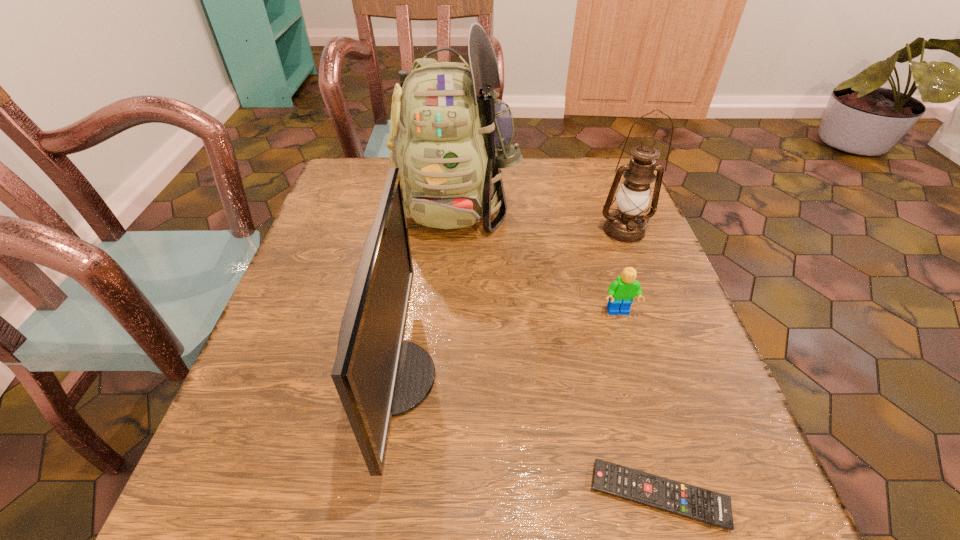
The height and width of the screenshot is (540, 960). I want to click on vacant point located between the Lego and the remote control, so click(638, 404).

This screenshot has height=540, width=960. What are the coordinates of `empty space that is in between the shortest object and the monitor` in the screenshot? It's located at (525, 437).

The width and height of the screenshot is (960, 540). Identify the location of free space between the monitor and the fourth tallest object. (505, 345).

At what (x,y) coordinates should I click in order to perform the action: click on free area in between the oil lamp and the backpack. Please return your answer as a coordinate pair (x, y). Looking at the image, I should click on (540, 215).

The width and height of the screenshot is (960, 540). I want to click on vacant area between the fourth tallest object and the oil lamp, so click(621, 272).

Where is `object that is the third closest one to the tallest object`? The height and width of the screenshot is (540, 960). object that is the third closest one to the tallest object is located at coordinates (621, 292).

Image resolution: width=960 pixels, height=540 pixels. In order to click on the closest object relative to the tallest object in this screenshot , I will do `click(378, 375)`.

At what (x,y) coordinates should I click in order to perform the action: click on vacant space that satisfies the following two spatial constraints: 1. on the front-facing side of the backpack; 2. on the left side of the remote control. Please return your answer as a coordinate pair (x, y). Looking at the image, I should click on (435, 495).

The width and height of the screenshot is (960, 540). In order to click on free point that satisfies the following two spatial constraints: 1. on the face of the Lego; 2. on the screen side of the monitor in this screenshot , I will do `click(638, 378)`.

Where is `vacant space that satisfies the following two spatial constraints: 1. on the screen side of the monitor; 2. on the back side of the shortest object`? The width and height of the screenshot is (960, 540). vacant space that satisfies the following two spatial constraints: 1. on the screen side of the monitor; 2. on the back side of the shortest object is located at coordinates (372, 495).